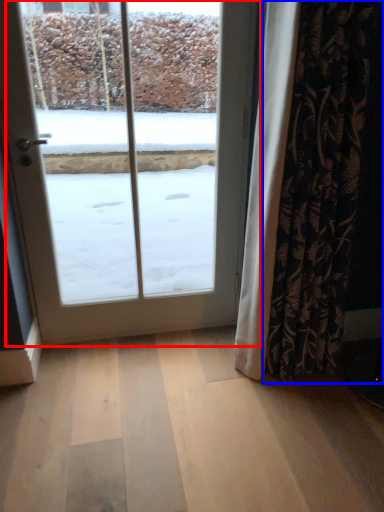
Question: Which point is closer to the camera, door (highlighted by a red box) or curtain (highlighted by a blue box)?

Choices:
 (A) door
 (B) curtain

Answer: (B)